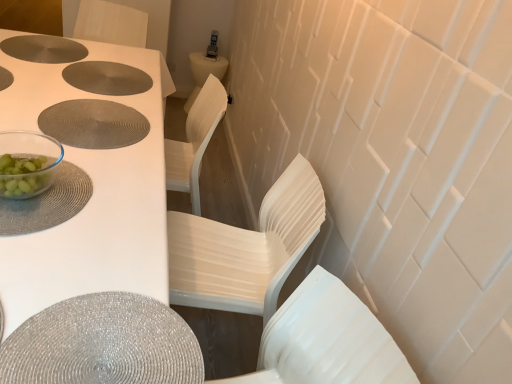
Locate an element on the screen. This screenshot has width=512, height=384. vacant space positioned to the left of matte gray placemat at upper left, which is counted as the second hole, starting from the top is located at coordinates (44, 55).